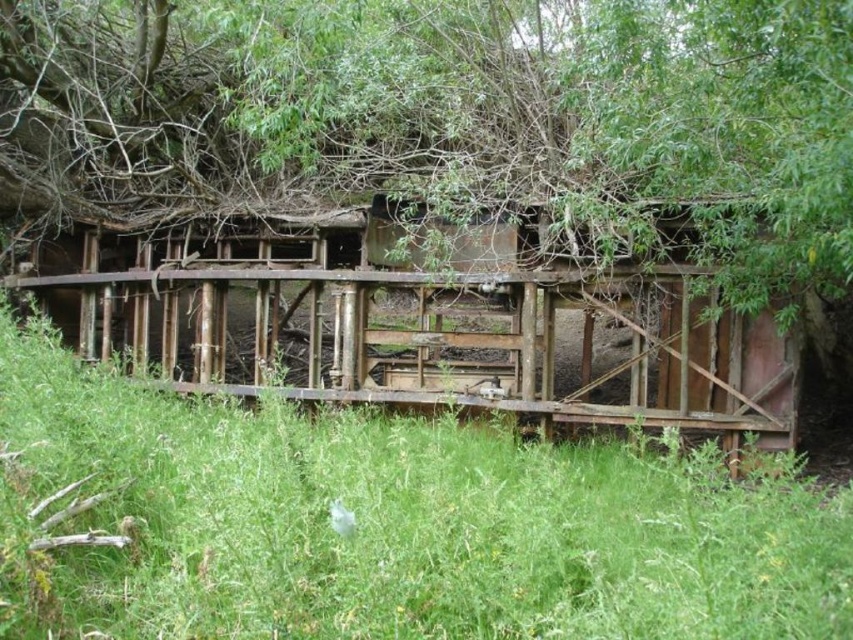
Can you confirm if green leafy tree at upper center is taller than green grassy at center?

No, green leafy tree at upper center is not taller than green grassy at center.

Who is more distant from viewer, (219, 161) or (844, 630)?

Positioned behind is point (219, 161).

The image size is (853, 640). Identify the location of green leafy tree at upper center. (468, 115).

Who is more distant from viewer, (x=793, y=563) or (x=579, y=275)?

The point (x=579, y=275) is more distant.

Where is `green grassy at center`? green grassy at center is located at coordinates (405, 522).

Who is lower down, green leafy tree at upper center or rusty wood hut at center?

rusty wood hut at center

Does green leafy tree at upper center have a smaller size compared to rusty wood hut at center?

Indeed, green leafy tree at upper center has a smaller size compared to rusty wood hut at center.

Describe the element at coordinates (468, 115) in the screenshot. I see `green leafy tree at upper center` at that location.

I want to click on green leafy tree at upper center, so click(x=468, y=115).